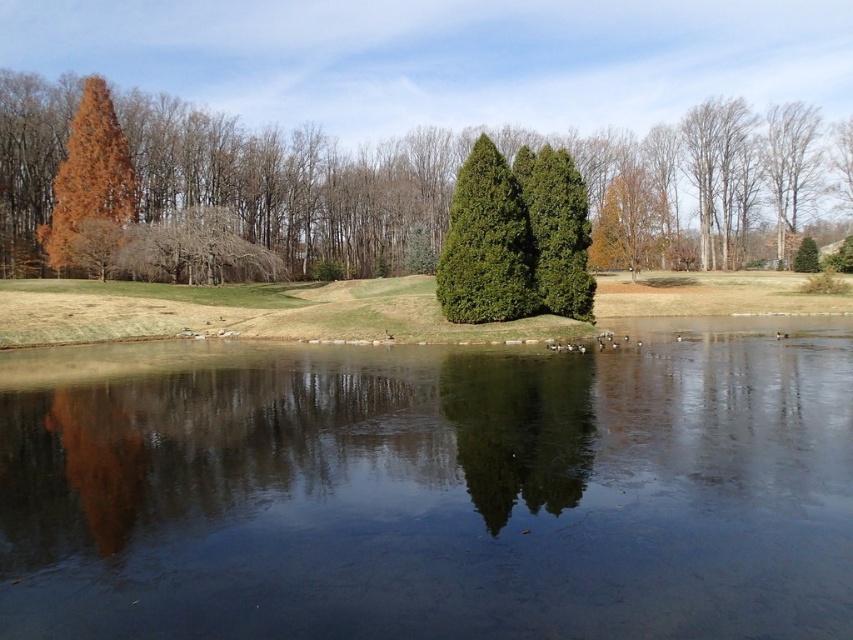
Question: Is smooth dark water at center bigger than orange matte cypress tree at left?

Choices:
 (A) yes
 (B) no

Answer: (B)

Question: Is the position of green grassy golf course at center more distant than that of orange matte cypress tree at left?

Choices:
 (A) yes
 (B) no

Answer: (B)

Question: Which point appears closest to the camera in this image?

Choices:
 (A) (675, 428)
 (B) (113, 531)
 (C) (460, 200)
 (D) (469, 369)

Answer: (B)

Question: Can you confirm if smooth dark water at center is positioned below orange matte tree at upper left?

Choices:
 (A) no
 (B) yes

Answer: (B)

Question: Among these points, which one is nearest to the camera?

Choices:
 (A) (645, 180)
 (B) (387, 321)

Answer: (B)

Question: Which object is the farthest from the green glossy trees at center?

Choices:
 (A) orange matte cypress tree at left
 (B) green grassy golf course at center

Answer: (A)